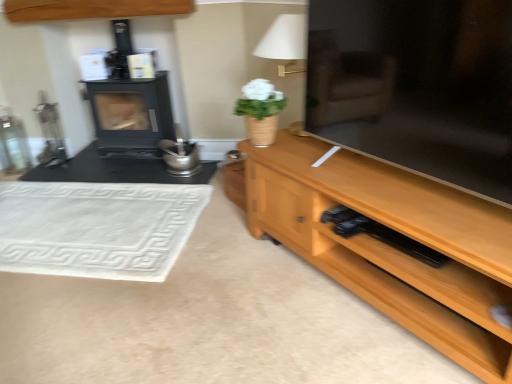
Describe the element at coordinates (92, 9) in the screenshot. I see `wooden cabinet at upper center` at that location.

Where is `black matte wood burning stove at left`? The width and height of the screenshot is (512, 384). black matte wood burning stove at left is located at coordinates (131, 116).

I want to click on wooden tv stand at right, so click(391, 247).

Is white fabric lampshade at upper center not within white woven mat at lower left?

Absolutely, white fabric lampshade at upper center is external to white woven mat at lower left.

In terms of width, does white fabric lampshade at upper center look wider or thinner when compared to white woven mat at lower left?

Considering their sizes, white fabric lampshade at upper center looks slimmer than white woven mat at lower left.

This screenshot has width=512, height=384. In the image, there is a white fabric lampshade at upper center. Find the location of `mat below it (from the image's perspective)`. mat below it (from the image's perspective) is located at coordinates (97, 228).

In the scene shown: Is white fabric lampshade at upper center not close to white woven mat at lower left?

Yes.

Is black matte wood burning stove at left inside or outside of white matte vase at center?

black matte wood burning stove at left cannot be found inside white matte vase at center.

From the image's perspective, which one is positioned higher, black matte wood burning stove at left or white matte vase at center?

black matte wood burning stove at left is shown above in the image.

Who is smaller, black matte wood burning stove at left or white matte vase at center?

With smaller size is white matte vase at center.

How far apart are black matte wood burning stove at left and white matte vase at center?

black matte wood burning stove at left is 4.71 feet away from white matte vase at center.

Which object is positioned more to the left, white fabric lampshade at upper center or white matte vase at center?

white matte vase at center is more to the left.

Which of these two, white fabric lampshade at upper center or white matte vase at center, stands shorter?

Standing shorter between the two is white matte vase at center.

Could you tell me if white fabric lampshade at upper center is turned towards white matte vase at center?

Yes, white fabric lampshade at upper center faces towards white matte vase at center.

Can you see white fabric lampshade at upper center touching white matte vase at center?

No, white fabric lampshade at upper center is not next to white matte vase at center.

In terms of size, does white woven mat at lower left appear bigger or smaller than white matte vase at center?

white woven mat at lower left is bigger than white matte vase at center.

This screenshot has height=384, width=512. I want to click on houseplant lying above the white woven mat at lower left (from the image's perspective), so click(260, 111).

Consider the image. Are white woven mat at lower left and white matte vase at center far apart?

Actually, white woven mat at lower left and white matte vase at center are a little close together.

How many degrees apart are the facing directions of white woven mat at lower left and white matte vase at center?

They differ by 42.9 degrees in their facing directions.

Which point is more distant from viewer, (66, 226) or (303, 34)?

The point (66, 226) is farther.

Considering the relative positions of white woven mat at lower left and white fabric lampshade at upper center in the image provided, is white woven mat at lower left to the left or to the right of white fabric lampshade at upper center?

Clearly, white woven mat at lower left is on the left of white fabric lampshade at upper center in the image.

From a real-world perspective, is white woven mat at lower left positioned under white fabric lampshade at upper center based on gravity?

Correct, in the physical world, white woven mat at lower left is lower than white fabric lampshade at upper center.

Is white woven mat at lower left positioned with its back to white fabric lampshade at upper center?

That's not correct — white woven mat at lower left is not looking away from white fabric lampshade at upper center.

Can you confirm if white matte vase at center is positioned to the left of wooden cabinet at upper center?

Incorrect, white matte vase at center is not on the left side of wooden cabinet at upper center.

Can you tell me how much white matte vase at center and wooden cabinet at upper center differ in facing direction?

white matte vase at center and wooden cabinet at upper center are facing 44.6 degrees away from each other.

Is white matte vase at center outside of wooden cabinet at upper center?

Indeed, white matte vase at center is completely outside wooden cabinet at upper center.

Is wooden cabinet at upper center next to wooden tv stand at right?

They are not placed beside each other.

From a real-world perspective, does wooden cabinet at upper center sit lower than wooden tv stand at right?

Incorrect, from a real-world perspective, wooden cabinet at upper center is higher than wooden tv stand at right.

Looking at this image, considering the sizes of wooden cabinet at upper center and wooden tv stand at right in the image, is wooden cabinet at upper center taller or shorter than wooden tv stand at right?

wooden cabinet at upper center is taller than wooden tv stand at right.

Who is more distant, wooden cabinet at upper center or wooden tv stand at right?

wooden cabinet at upper center.

Locate an element on the screen. mat that appears behind the white fabric lampshade at upper center is located at coordinates (97, 228).

The image size is (512, 384). In order to click on houseplant lying on the right of black matte wood burning stove at left in this screenshot , I will do `click(260, 111)`.

Estimate the real-world distances between objects in this image. Which object is further from black matte wood burning stove at left, white matte vase at center or white fabric lampshade at upper center?

Based on the image, white matte vase at center appears to be further to black matte wood burning stove at left.

Estimate the real-world distances between objects in this image. Which object is closer to white matte vase at center, wooden cabinet at upper center or white fabric lampshade at upper center?

Among the two, white fabric lampshade at upper center is located nearer to white matte vase at center.

Looking at the image, which one is located further to wooden tv stand at right, white woven mat at lower left or white matte vase at center?

white woven mat at lower left is positioned further to the anchor wooden tv stand at right.

Which object lies nearer to the anchor point white fabric lampshade at upper center, wooden cabinet at upper center or white woven mat at lower left?

wooden cabinet at upper center is closer to white fabric lampshade at upper center.

Looking at the image, which one is located further to wooden cabinet at upper center, white woven mat at lower left or wooden tv stand at right?

wooden tv stand at right is positioned further to the anchor wooden cabinet at upper center.

Estimate the real-world distances between objects in this image. Which object is closer to black matte wood burning stove at left, white fabric lampshade at upper center or white woven mat at lower left?

white woven mat at lower left lies closer to black matte wood burning stove at left than the other object.

From the image, which object appears to be farther from wooden cabinet at upper center, white woven mat at lower left or black matte wood burning stove at left?

The object further to wooden cabinet at upper center is white woven mat at lower left.

Which object lies further to the anchor point black matte wood burning stove at left, wooden cabinet at upper center or wooden tv stand at right?

wooden tv stand at right is positioned further to the anchor black matte wood burning stove at left.

At what (x,y) coordinates should I click in order to perform the action: click on table lamp between wooden tv stand at right and black matte wood burning stove at left from front to back. Please return your answer as a coordinate pair (x, y). Looking at the image, I should click on (284, 41).

Identify the location of cabinetry located between white woven mat at lower left and white fabric lampshade at upper center in the left-right direction. The width and height of the screenshot is (512, 384). (92, 9).

The height and width of the screenshot is (384, 512). I want to click on wood burning stove between wooden cabinet at upper center and white matte vase at center, so click(131, 116).

The width and height of the screenshot is (512, 384). What are the coordinates of `mat between wooden tv stand at right and wooden cabinet at upper center in the front-back direction` in the screenshot? It's located at (97, 228).